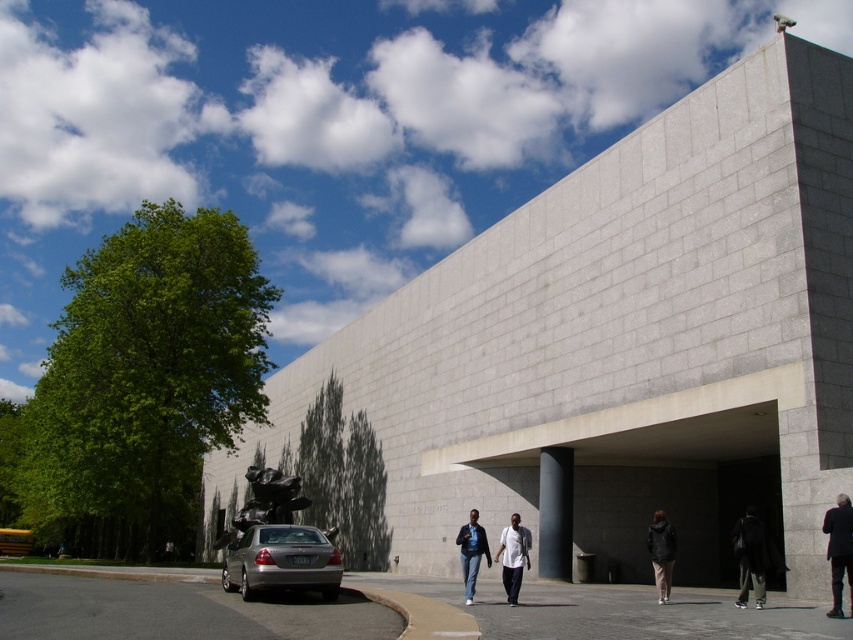
You are standing at the entrance of the modern building and looking towards the parking lot. There are two points marked on the ground near the silver sedan. One is at point (300, 525) and the other at point (851, 540). Which point is closer to you?

Point (300, 525) is closer to you as it is further to the viewer than point (851, 540).

You are a delivery person trying to park your truck next to the silver metallic sedan at lower left. The truck is wider than the sedan. Based on the scene, can you determine if the dark gray jacket at lower right might block your parking space?

The silver metallic sedan at lower left is thinner than the dark gray jacket at lower right, so the dark gray jacket at lower right is wider. Since your truck is wider than the sedan, the dark gray jacket at lower right might be too wide and block the parking space.

You are a delivery person who needs to park your 1.8 meters tall delivery cart between the silver metallic sedan at lower left and the dark gray suit at lower right. Can your cart fit vertically between them without touching either?

The silver metallic sedan at lower left is not as tall as dark gray suit at lower right, so the vertical space between them is determined by the shorter object, which is the sedan. Since the sedan is under 1.8 meters tall, the cart cannot fit vertically between them without touching.